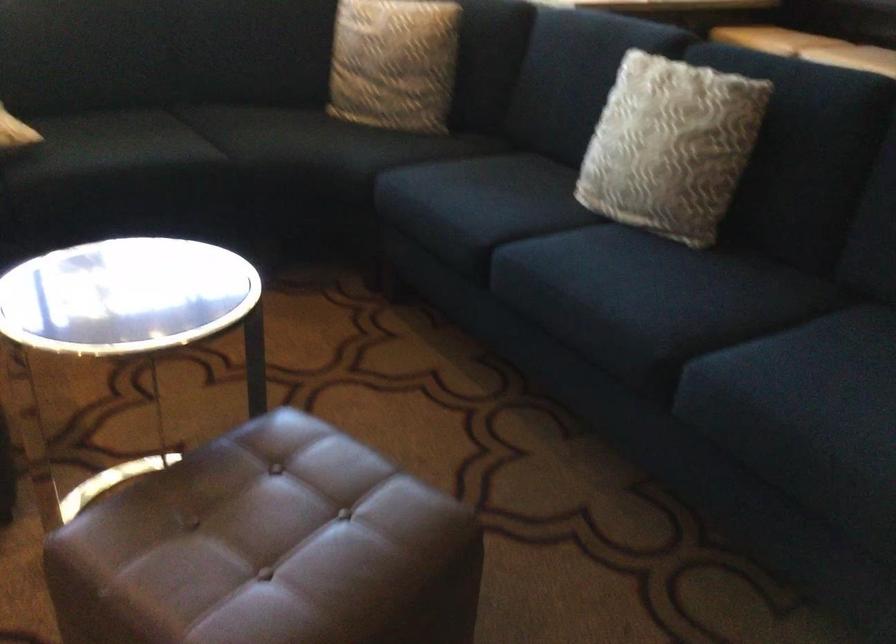
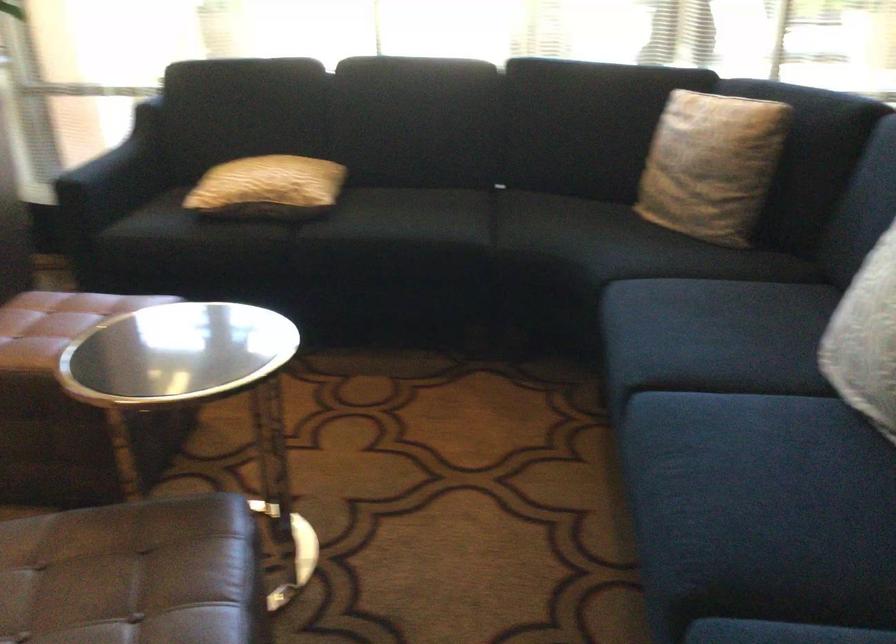
Question: The images are taken continuously from a first-person perspective. In which direction is your viewpoint rotating?

Choices:
 (A) Left
 (B) Right
 (C) Up
 (D) Down

Answer: (A)